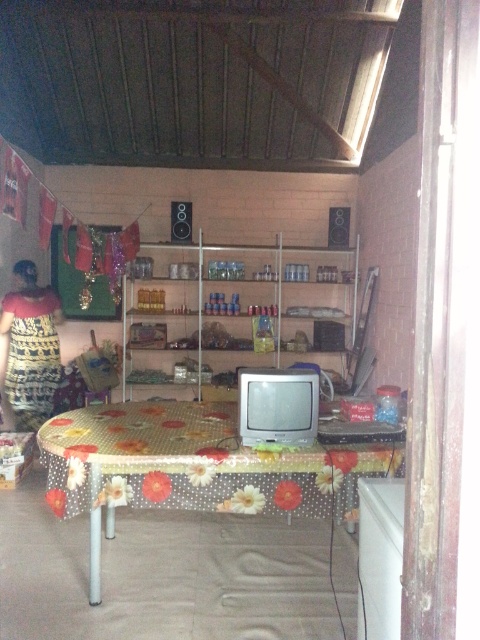
Question: Is floral-patterned fabric table at center to the right of metallic shelves at center from the viewer's perspective?

Choices:
 (A) yes
 (B) no

Answer: (B)

Question: From the image, what is the correct spatial relationship of floral-patterned fabric table at center in relation to metallic shelves at center?

Choices:
 (A) above
 (B) below

Answer: (B)

Question: Among these objects, which one is nearest to the camera?

Choices:
 (A) metallic shelves at center
 (B) floral-patterned fabric table at center

Answer: (B)

Question: Can you confirm if floral-patterned fabric table at center is bigger than metallic shelves at center?

Choices:
 (A) yes
 (B) no

Answer: (A)